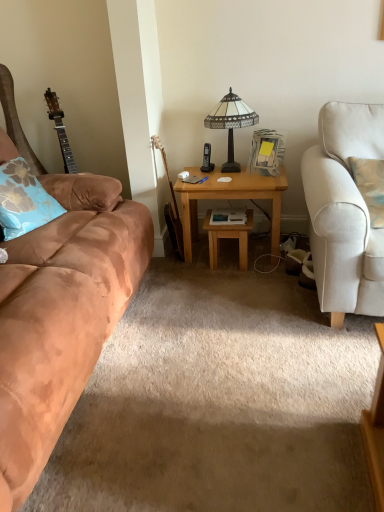
You are a GUI agent. You are given a task and a screenshot of the screen. Output one action in this format:
    pyautogui.click(x=<x>, y=<y>)
    Task: Click on the free space between wooden table at center and wooden desk at center
    The image size is (384, 512).
    Given the screenshot: What is the action you would take?
    pyautogui.click(x=227, y=266)